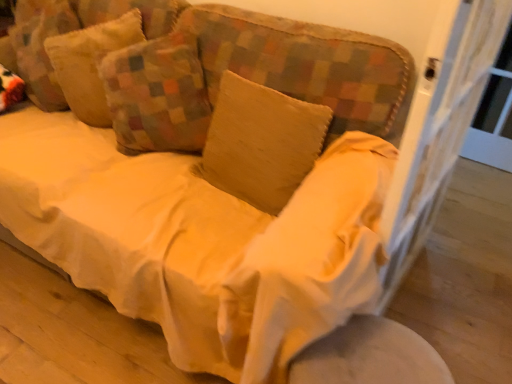
Question: From a real-world perspective, is beige cotton pillow at center, marked as the third pillow in a left-to-right arrangement, physically located above or below textured beige pillow at upper left, the 1th pillow when ordered from left to right?

Choices:
 (A) below
 (B) above

Answer: (A)

Question: Is beige cotton pillow at center, arranged as the 1th pillow when viewed from the right, inside the boundaries of textured beige pillow at upper left, the 1th pillow when ordered from left to right, or outside?

Choices:
 (A) inside
 (B) outside

Answer: (B)

Question: Which is nearer to the beige cotton pillow at center, arranged as the 1th pillow when viewed from the right?

Choices:
 (A) textured beige pillow at upper left, which is counted as the second pillow, starting from the left
 (B) textured beige pillow at upper left, the 3th pillow from the right
 (C) white wood screen door at right
 (D) white fabric round table at lower right

Answer: (A)

Question: Which of these objects is positioned closest to the beige cotton pillow at center, marked as the third pillow in a left-to-right arrangement?

Choices:
 (A) textured beige pillow at upper left, the 3th pillow from the right
 (B) textured beige pillow at upper left, which is counted as the second pillow, starting from the left
 (C) white fabric round table at lower right
 (D) white wood screen door at right

Answer: (B)